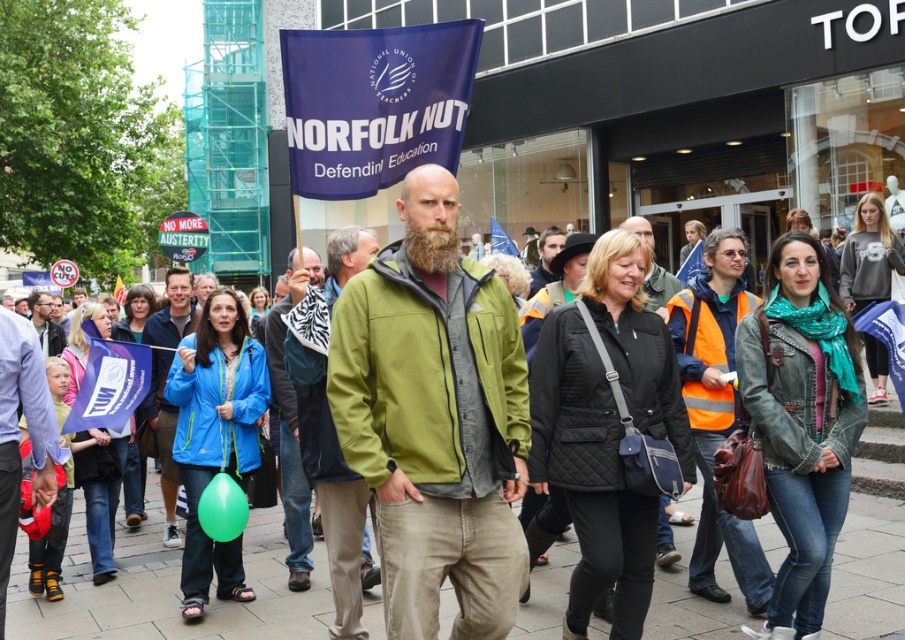
Question: Is green fabric scarf at center further to the viewer compared to bearded man at center?

Choices:
 (A) no
 (B) yes

Answer: (A)

Question: Estimate the real-world distances between objects in this image. Which object is farther from the bearded man at center?

Choices:
 (A) smooth concrete pavement at center
 (B) green fabric scarf at center
 (C) dark brown fuzzy beard at center

Answer: (A)

Question: Which object is the farthest from the dark brown fuzzy beard at center?

Choices:
 (A) smooth concrete pavement at center
 (B) brownwoodybeard at center

Answer: (A)

Question: Among these objects, which one is farthest from the camera?

Choices:
 (A) dark brown fuzzy beard at center
 (B) smooth concrete pavement at center
 (C) bearded man at center

Answer: (C)

Question: Is the position of dark brown fuzzy beard at center less distant than that of smooth concrete pavement at center?

Choices:
 (A) yes
 (B) no

Answer: (A)

Question: Observing the image, what is the correct spatial positioning of green matte jacket at center in reference to matte black jacket at center?

Choices:
 (A) above
 (B) below

Answer: (B)